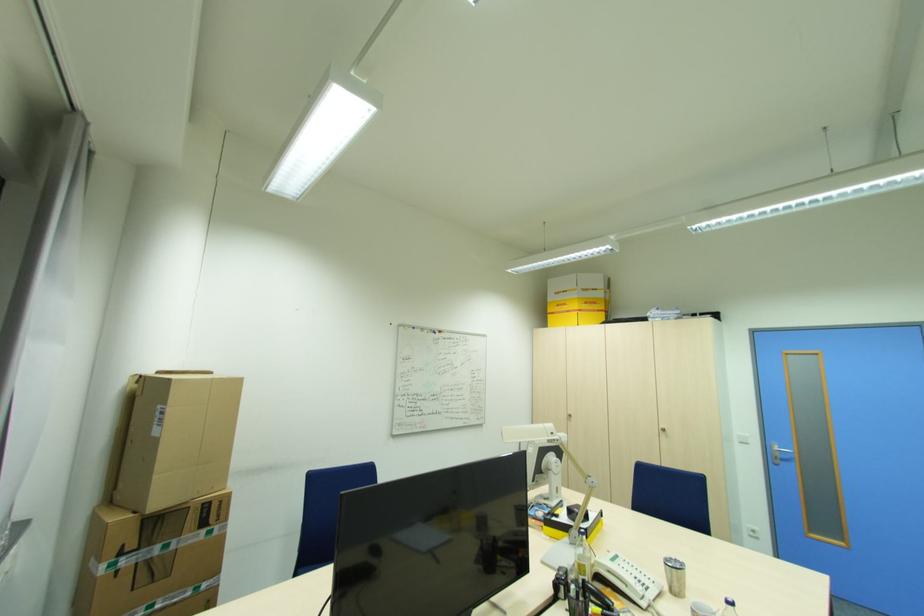
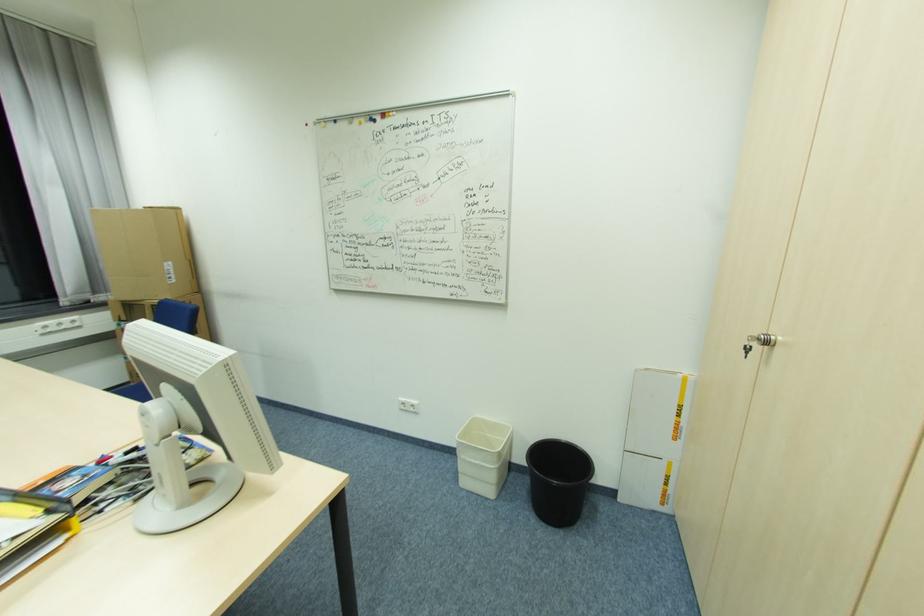
Find the pixel in the second image that matches (x=134, y=546) in the first image.

(127, 318)